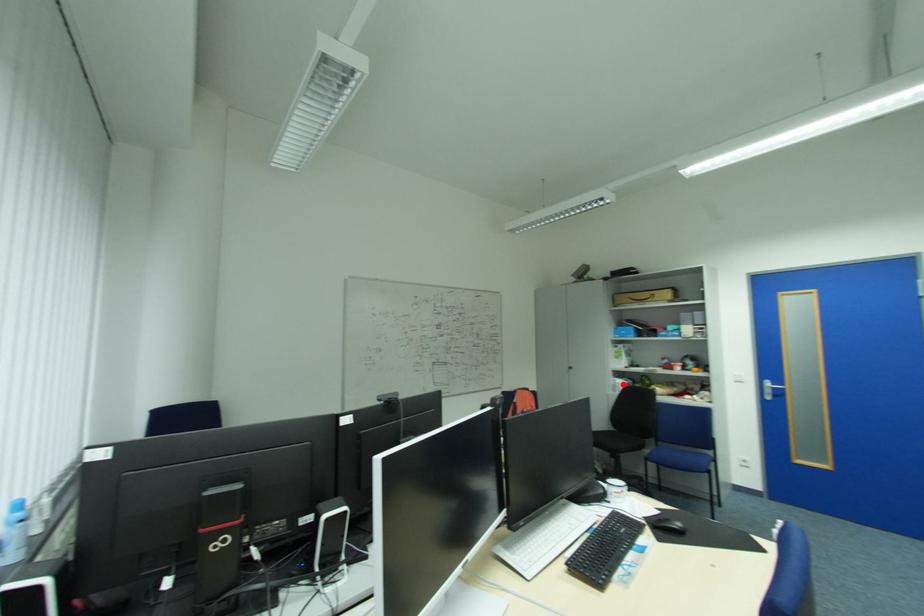
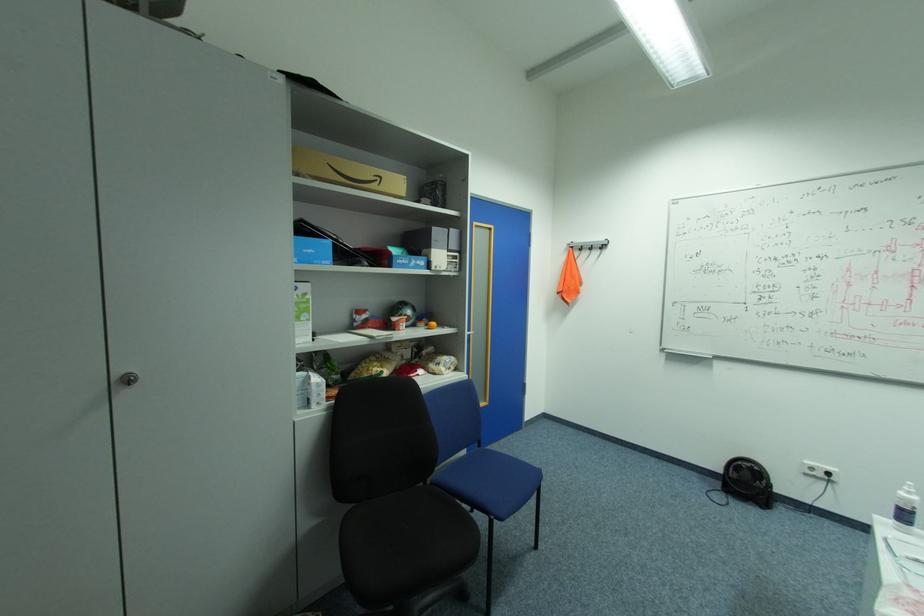
Question: I am providing you with two images of the same scene from different viewpoints. In image1, a red point is highlighted. Considering the same 3D point in image2, which of the following is correct?

Choices:
 (A) It is closer
 (B) It is farther

Answer: (A)